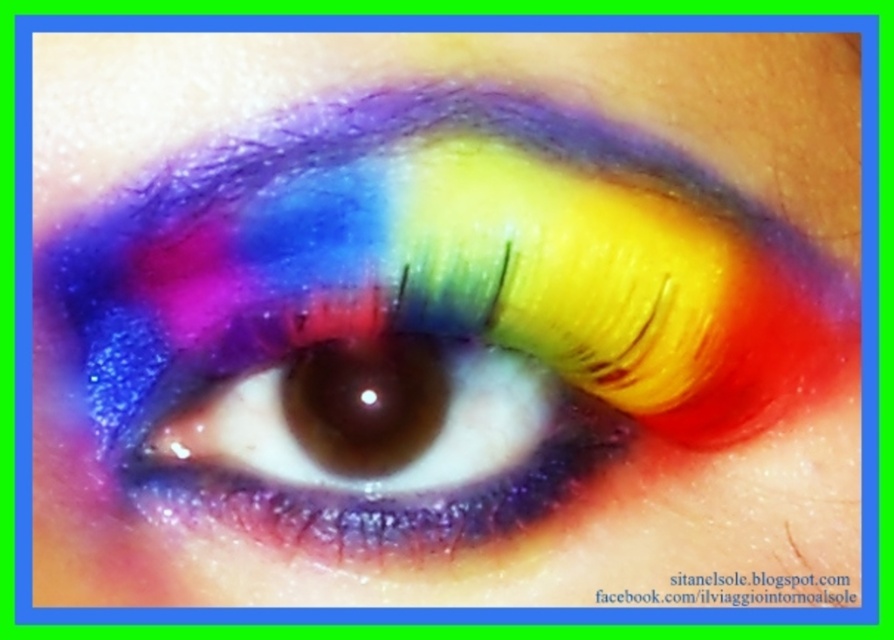
You are a makeup artist trying to apply eyeliner between the shimmering rainbow eye at center and shiny rainbow eye at center. The eyeliner pencil you have is 3 centimeters long. Can you fit the eyeliner between them without needing to lift the pencil?

The distance between shimmering rainbow eye at center and shiny rainbow eye at center is 3.37 centimeters. Since the eyeliner pencil is only 3 centimeters long, it is shorter than the required space. Therefore, you cannot fit the eyeliner between them without lifting the pencil.

You are a makeup artist trying to determine which eye has a more pronounced height in the image. You observe both the shimmering rainbow eye at center and the shiny rainbow eye at center. Which one is taller?

The shimmering rainbow eye at center is taller than the shiny rainbow eye at center according to the description.

You are a makeup artist trying to determine which eye to apply the next layer of glitter. You have two options in the image, the shimmering rainbow eye at center and the shiny rainbow eye at center. Which one is positioned closer to you?

The shimmering rainbow eye at center is closer to the viewer than the shiny rainbow eye at center, so you should apply the next layer of glitter to the shimmering rainbow eye at center first.